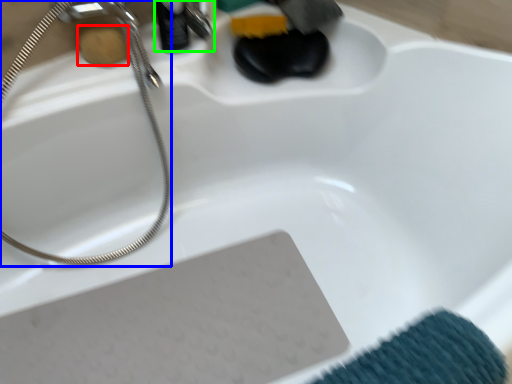
Question: Considering the real-world distances, which object is closest to soap (highlighted by a red box)? shower (highlighted by a blue box) or faucet (highlighted by a green box).

Choices:
 (A) shower
 (B) faucet

Answer: (B)